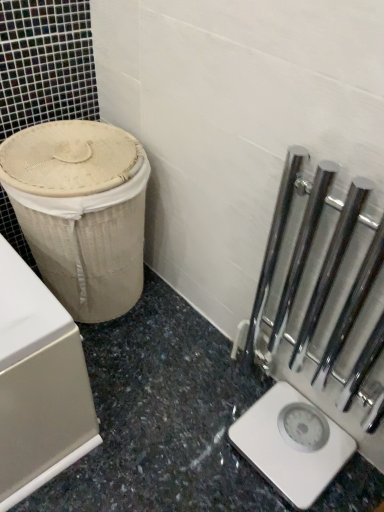
Question: Is beige woven basket at left shorter than polished chrome rail at right?

Choices:
 (A) yes
 (B) no

Answer: (A)

Question: Can you confirm if beige woven basket at left is positioned to the left of polished chrome rail at right?

Choices:
 (A) no
 (B) yes

Answer: (B)

Question: From a real-world perspective, is beige woven basket at left below polished chrome rail at right?

Choices:
 (A) yes
 (B) no

Answer: (A)

Question: Would you consider beige woven basket at left to be distant from polished chrome rail at right?

Choices:
 (A) yes
 (B) no

Answer: (B)

Question: From a real-world perspective, is beige woven basket at left positioned over polished chrome rail at right based on gravity?

Choices:
 (A) yes
 (B) no

Answer: (B)

Question: Would you say beige woven basket at left contains polished chrome rail at right?

Choices:
 (A) no
 (B) yes

Answer: (A)

Question: Is beige woven basket at left located outside white plastic scale at lower right?

Choices:
 (A) yes
 (B) no

Answer: (A)

Question: Considering the relative sizes of beige woven basket at left and white plastic scale at lower right in the image provided, is beige woven basket at left shorter than white plastic scale at lower right?

Choices:
 (A) yes
 (B) no

Answer: (B)

Question: Is white plastic scale at lower right at the back of beige woven basket at left?

Choices:
 (A) yes
 (B) no

Answer: (B)

Question: From the image's perspective, is beige woven basket at left below white plastic scale at lower right?

Choices:
 (A) no
 (B) yes

Answer: (A)

Question: Is beige woven basket at left positioned before white plastic scale at lower right?

Choices:
 (A) yes
 (B) no

Answer: (A)

Question: Considering the relative sizes of beige woven basket at left and white plastic scale at lower right in the image provided, is beige woven basket at left bigger than white plastic scale at lower right?

Choices:
 (A) yes
 (B) no

Answer: (A)

Question: Is the position of white plastic scale at lower right less distant than that of polished chrome rail at right?

Choices:
 (A) no
 (B) yes

Answer: (A)